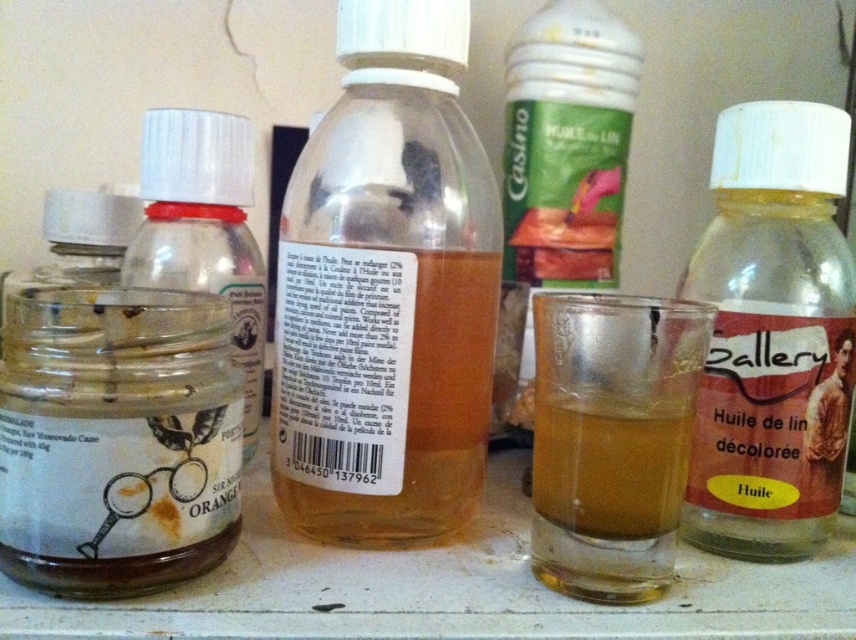
You are organizing items on a shelf and need to place a new item between the small glass jar with a white cap and the larger plastic bottle with a white cap. According to the current arrangement, where should you position the new item relative to the yellow translucent bottle at center?

The yellow translucent bottle at center is located at point (771, 333), so you should position the new item between the small glass jar with a white cap and the larger plastic bottle with a white cap to the left of the yellow translucent bottle at center.